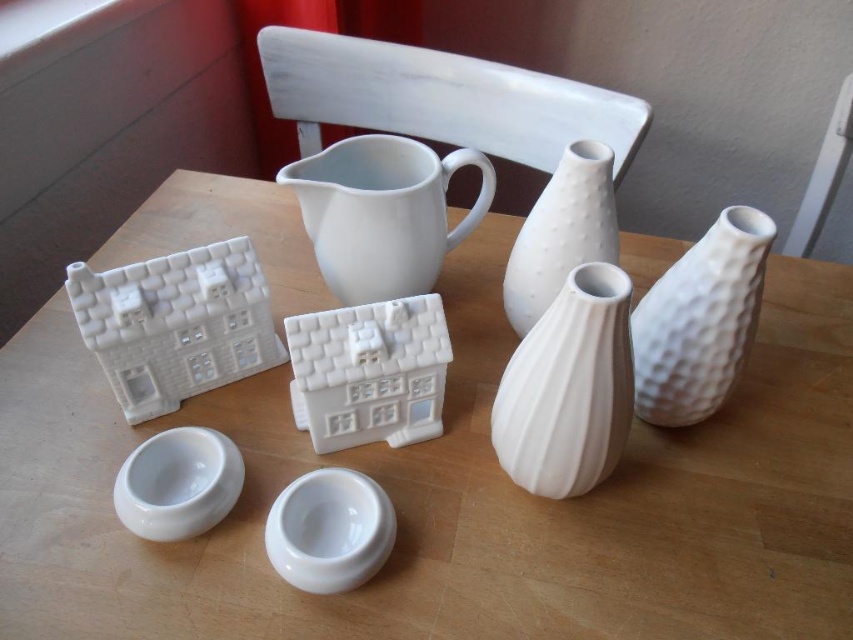
Question: Estimate the real-world distances between objects in this image. Which object is closer to the white glossy bowl at lower center?

Choices:
 (A) white matte jug at center
 (B) white textured vase at center
 (C) white matte table at center

Answer: (B)

Question: From the image, what is the correct spatial relationship of white matte table at center in relation to white textured vase at center?

Choices:
 (A) left
 (B) right

Answer: (A)

Question: Which object is positioned farthest from the white glossy bowl at lower left?

Choices:
 (A) white glossy bowl at lower center
 (B) white textured vase at center

Answer: (B)

Question: Can you confirm if white textured vase at right is positioned to the right of white glossy bowl at lower center?

Choices:
 (A) yes
 (B) no

Answer: (A)

Question: Can you confirm if white matte jug at center is bigger than white textured vase at right?

Choices:
 (A) no
 (B) yes

Answer: (A)

Question: Which of these objects is positioned closest to the white textured vase at upper center?

Choices:
 (A) white glossy bowl at lower center
 (B) white matte table at center
 (C) white glossy bowl at lower left
 (D) white textured vase at center

Answer: (D)